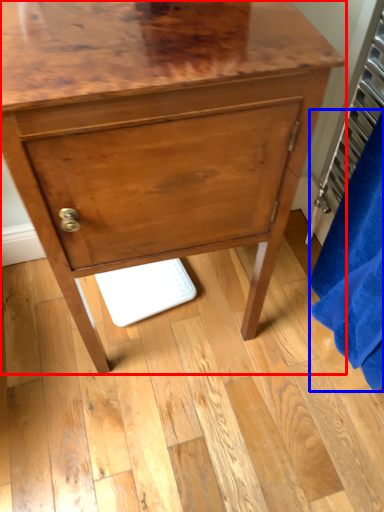
Question: Which object appears farthest to the camera in this image, chest of drawers (highlighted by a red box) or bath towel (highlighted by a blue box)?

Choices:
 (A) chest of drawers
 (B) bath towel

Answer: (A)